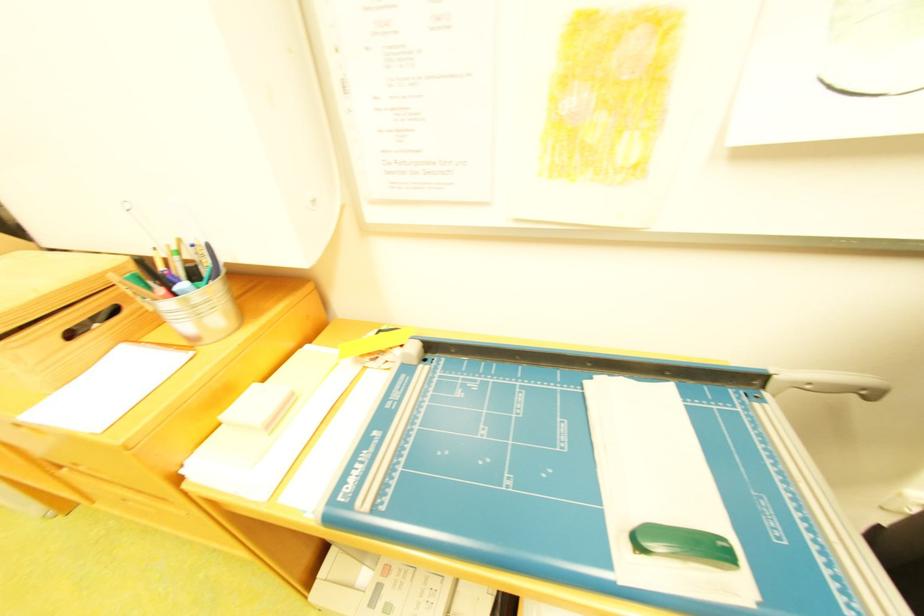
Identify the location of paper cutter handle. (829, 383).